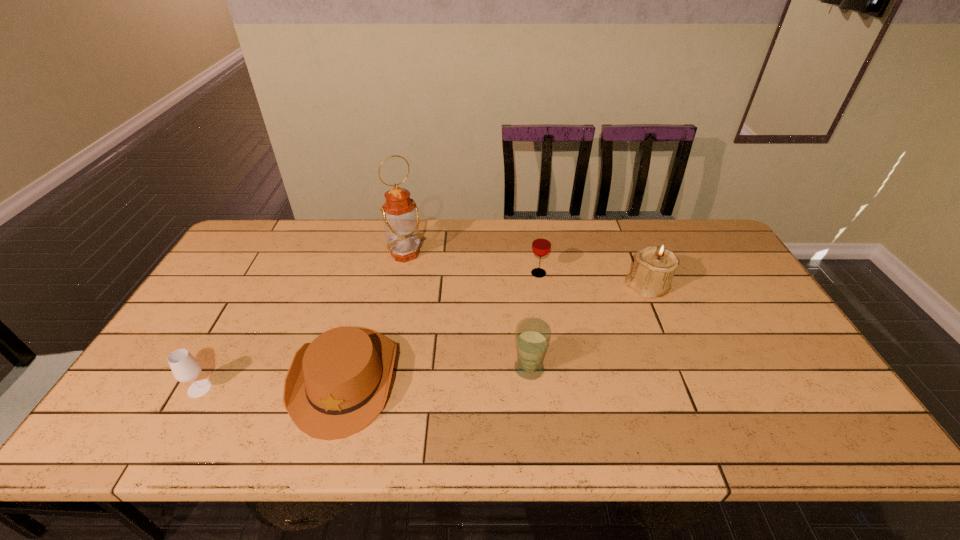
The width and height of the screenshot is (960, 540). I want to click on free point between the rightmost object and the cowboy hat, so click(x=496, y=333).

At what (x,y) coordinates should I click in order to perform the action: click on free area in between the shortest glass and the farthest object. Please return your answer as a coordinate pair (x, y). The height and width of the screenshot is (540, 960). Looking at the image, I should click on (302, 321).

Find the location of a particular element. Image resolution: width=960 pixels, height=540 pixels. free spot between the candle_holder and the farthest glass is located at coordinates (593, 280).

Find the location of `free space between the farthest glass and the oil lamp`. free space between the farthest glass and the oil lamp is located at coordinates (472, 264).

You are a GUI agent. You are given a task and a screenshot of the screen. Output one action in this format:
    pyautogui.click(x=<x>, y=<y>)
    Task: Click on the vacant space that is in between the farthest glass and the oil lamp
    
    Given the screenshot: What is the action you would take?
    pyautogui.click(x=472, y=264)

At what (x,y) coordinates should I click in order to perform the action: click on vacant area that lies between the candle_holder and the leftmost glass. Please return your answer as a coordinate pair (x, y). Looking at the image, I should click on 423,338.

Locate an element on the screen. object that is the nearest to the cowboy hat is located at coordinates (185, 368).

Point out which object is positioned as the second nearest to the second shortest object. Please provide its 2D coordinates. Your answer should be formatted as a tuple, i.e. [(x, y)], where the tuple contains the x and y coordinates of a point satisfying the conditions above.

[(400, 213)]

What are the coordinates of `glass that stands as the closest to the second shortest object` in the screenshot? It's located at (532, 336).

Where is `glass that can be found as the third closest to the rightmost object`? The image size is (960, 540). glass that can be found as the third closest to the rightmost object is located at coordinates (185, 368).